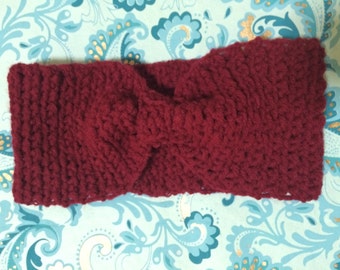
At what (x,y) coordinates should I click in order to perform the action: click on soft surface. Please return your answer as a coordinate pair (x, y). Looking at the image, I should click on (43, 101).